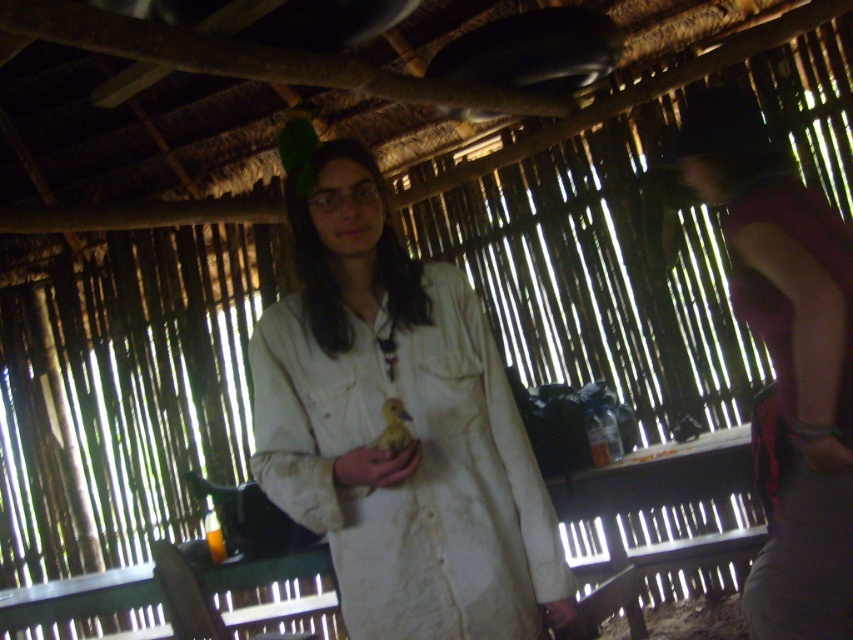
Question: Which object is the farthest from the white cotton shirt at center?

Choices:
 (A) smooth yellow duckling at center
 (B) white cotton robe at right

Answer: (B)

Question: Which object is closer to the camera taking this photo?

Choices:
 (A) white cotton shirt at center
 (B) smooth yellow duckling at center

Answer: (B)

Question: Does white cotton shirt at center have a smaller size compared to smooth yellow duckling at center?

Choices:
 (A) no
 (B) yes

Answer: (A)

Question: Which point appears farthest from the camera in this image?

Choices:
 (A) (x=352, y=448)
 (B) (x=807, y=262)

Answer: (B)

Question: Does white cotton shirt at center appear on the left side of smooth yellow duckling at center?

Choices:
 (A) yes
 (B) no

Answer: (A)

Question: Is white cotton shirt at center to the right of smooth yellow duckling at center from the viewer's perspective?

Choices:
 (A) yes
 (B) no

Answer: (B)